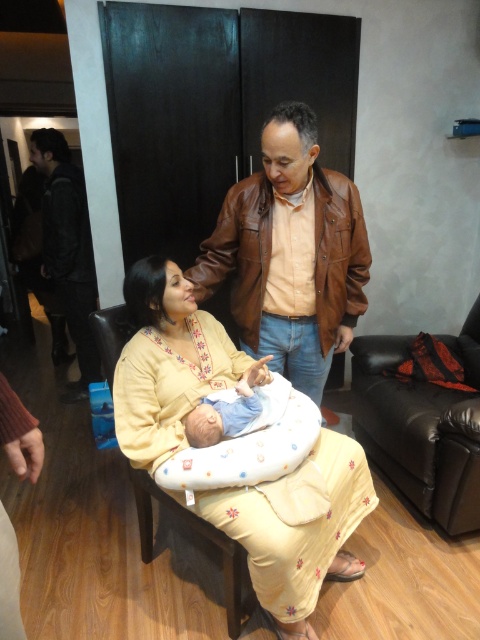
Question: Is yellow embroidered dress at center behind black leather armchair at right?

Choices:
 (A) yes
 (B) no

Answer: (B)

Question: Which is farther from the yellow embroidered dress at center?

Choices:
 (A) light brown fabric armchair at center
 (B) black leather armchair at right
 (C) black leather jacket at left
 (D) blue cotton newborn at center

Answer: (C)

Question: Considering the real-world distances, which object is closest to the black leather jacket at left?

Choices:
 (A) brown leather jacket at center
 (B) blue cotton newborn at center
 (C) black leather armchair at right

Answer: (A)

Question: Is brown leather jacket at center above black leather jacket at left?

Choices:
 (A) yes
 (B) no

Answer: (B)

Question: Is light brown fabric armchair at center above blue cotton newborn at center?

Choices:
 (A) no
 (B) yes

Answer: (A)

Question: Which of the following is the closest to the observer?

Choices:
 (A) (325, 557)
 (B) (308, 150)
 (C) (172, 509)

Answer: (A)